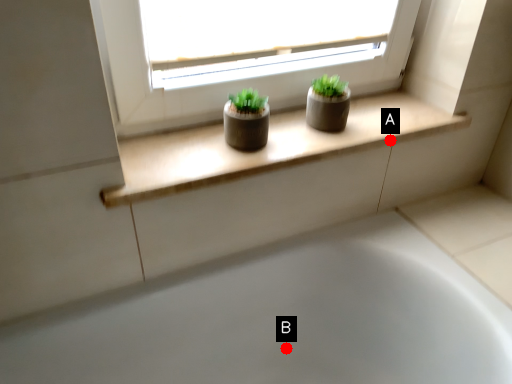
Question: Two points are circled on the image, labeled by A and B beside each circle. Which point is closer to the camera?

Choices:
 (A) A is closer
 (B) B is closer

Answer: (A)